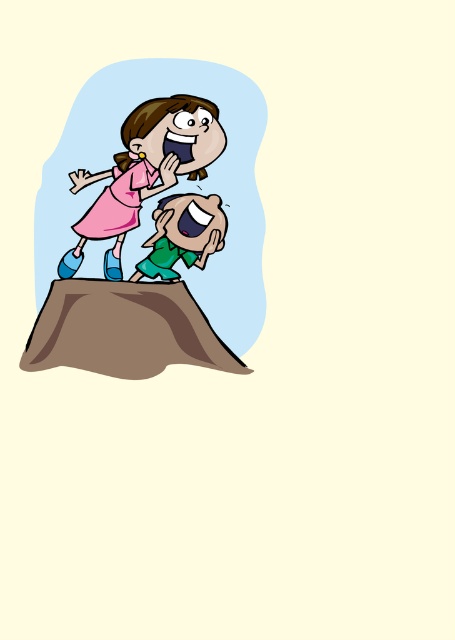
In the scene with two characters on a mound, there are two pink dresses described as pink fabric dress at upper center and pink matte dress at upper center. Which one is positioned lower?

The pink fabric dress at upper center is located below the pink matte dress at upper center, so it is positioned lower.